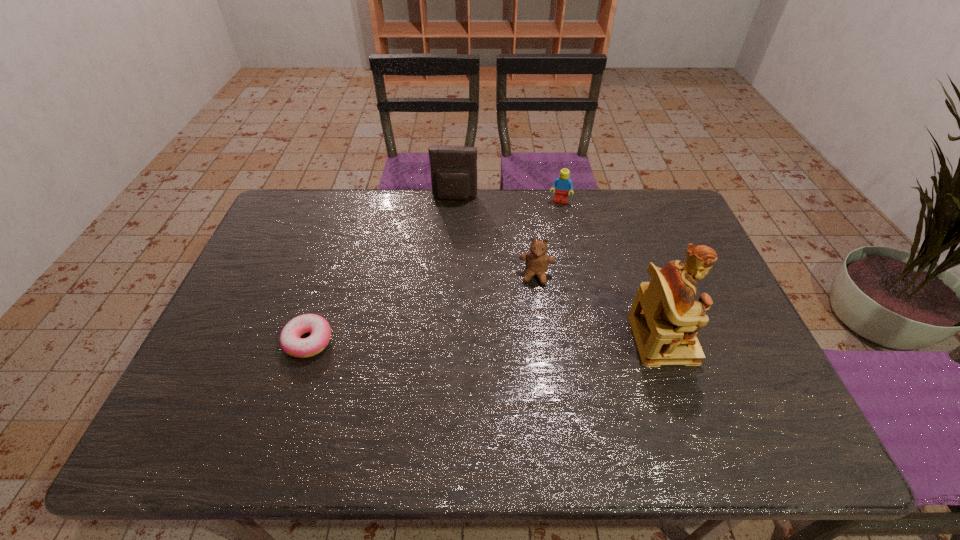
At what (x,y) coordinates should I click in order to perform the action: click on doughnut. Please return your answer as a coordinate pair (x, y). The height and width of the screenshot is (540, 960). Looking at the image, I should click on (290, 342).

This screenshot has width=960, height=540. What are the coordinates of `the shortest object` in the screenshot? It's located at (290, 342).

The height and width of the screenshot is (540, 960). What are the coordinates of `the rightmost object` in the screenshot? It's located at (665, 318).

Image resolution: width=960 pixels, height=540 pixels. In order to click on figurine in this screenshot , I will do `click(665, 318)`.

Where is `the third farthest object`? This screenshot has height=540, width=960. the third farthest object is located at coordinates tap(537, 260).

Locate an element on the screen. teddy bear is located at coordinates (537, 260).

Locate an element on the screen. the second object from left to right is located at coordinates (453, 168).

The height and width of the screenshot is (540, 960). I want to click on pouch, so click(453, 168).

Where is `the fourth object from left to right`? The width and height of the screenshot is (960, 540). the fourth object from left to right is located at coordinates [562, 184].

Locate an element on the screen. vacant region located on the right of the shortest object is located at coordinates (426, 341).